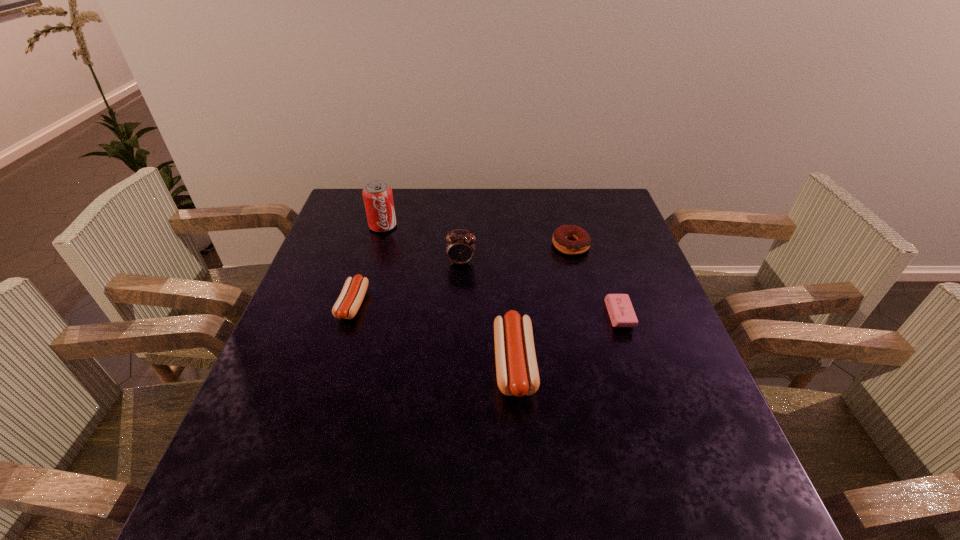
Locate an element on the screen. object positioned at the far left corner is located at coordinates (378, 199).

In the image, there is a desktop. Identify the location of vacant space at the far edge. This screenshot has width=960, height=540. (466, 204).

Identify the location of free space at the near edge of the desktop. Image resolution: width=960 pixels, height=540 pixels. (357, 451).

You are a GUI agent. You are given a task and a screenshot of the screen. Output one action in this format:
    pyautogui.click(x=<x>, y=<y>)
    Task: Click on the free space at the left edge of the desktop
    This screenshot has height=540, width=960.
    Given the screenshot: What is the action you would take?
    click(280, 348)

The height and width of the screenshot is (540, 960). In order to click on vacant area at the right edge of the desktop in this screenshot , I will do `click(647, 320)`.

The width and height of the screenshot is (960, 540). I want to click on vacant space at the near left corner of the desktop, so click(x=238, y=467).

Where is `free spot at the near right corner of the desktop`? The width and height of the screenshot is (960, 540). free spot at the near right corner of the desktop is located at coordinates (687, 460).

Image resolution: width=960 pixels, height=540 pixels. What are the coordinates of `vacant space that's between the tallest object and the fifth nearest object` in the screenshot? It's located at (477, 235).

Identify the location of vacant space that is in between the third object from left to right and the shorter sausage. (407, 284).

Where is `empty space that is in between the tallest object and the fifth nearest object`? This screenshot has height=540, width=960. empty space that is in between the tallest object and the fifth nearest object is located at coordinates (477, 235).